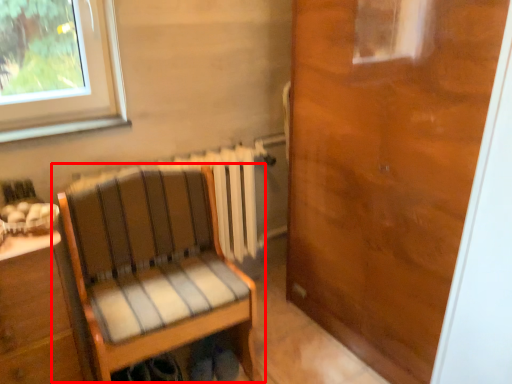
Question: Observing the image, what is the correct spatial positioning of chair (annotated by the red box) in reference to door?

Choices:
 (A) left
 (B) right

Answer: (A)